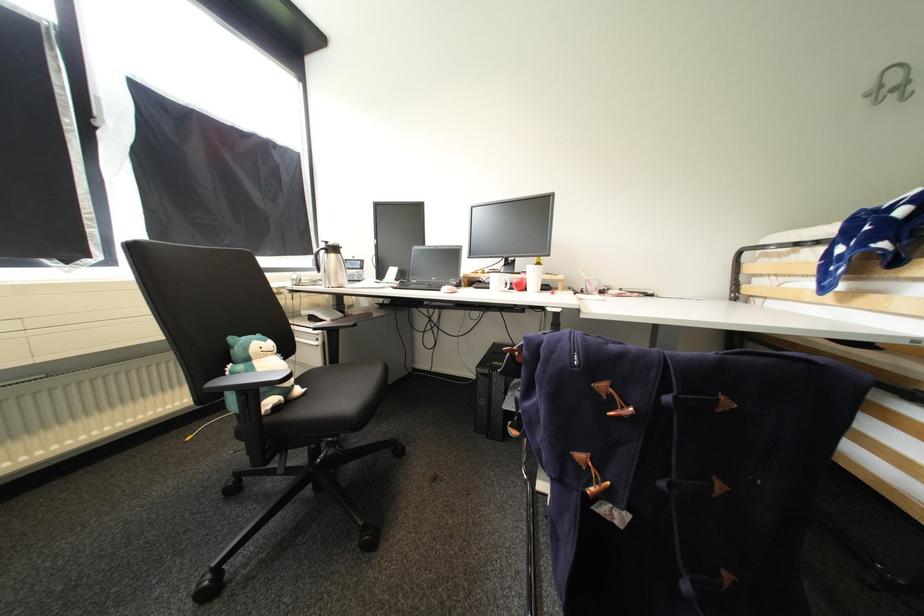
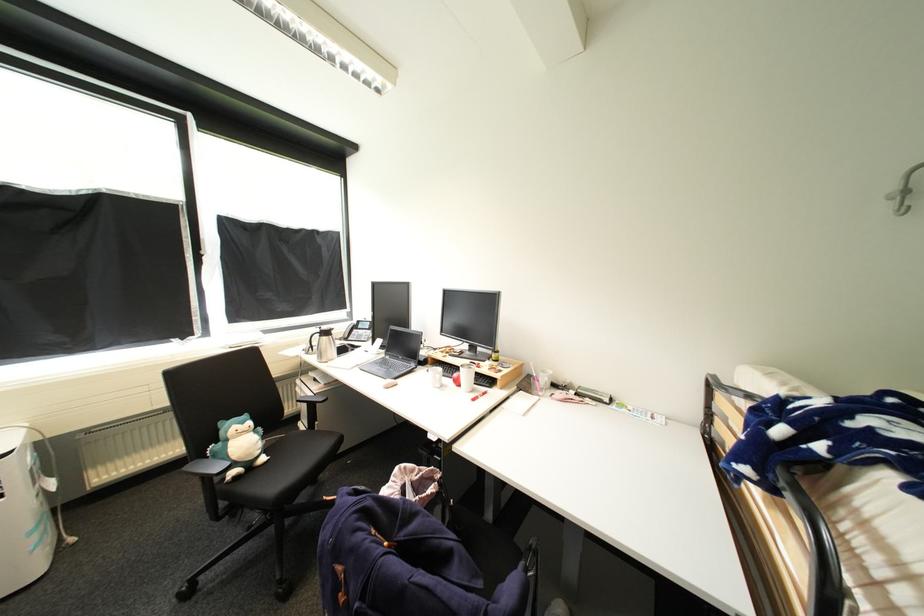
Find the pixel in the second image that matches pixel 272 342 in the first image.

(249, 424)